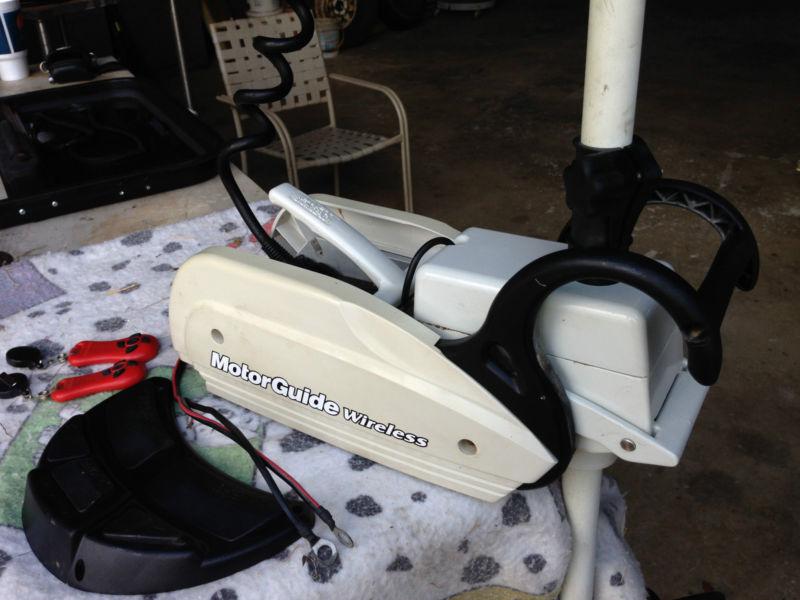
Find the location of `left side arm rest on chair`. left side arm rest on chair is located at coordinates (385, 90).